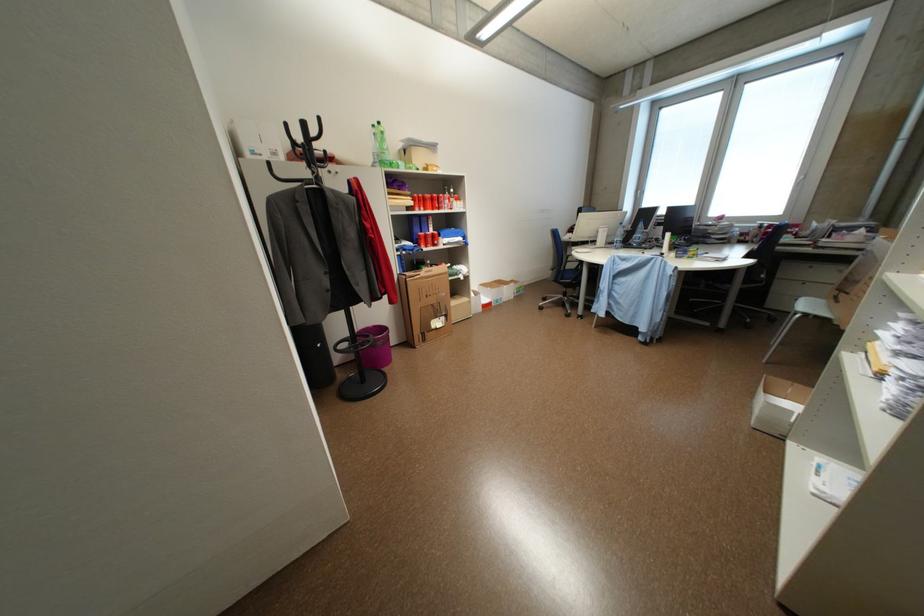
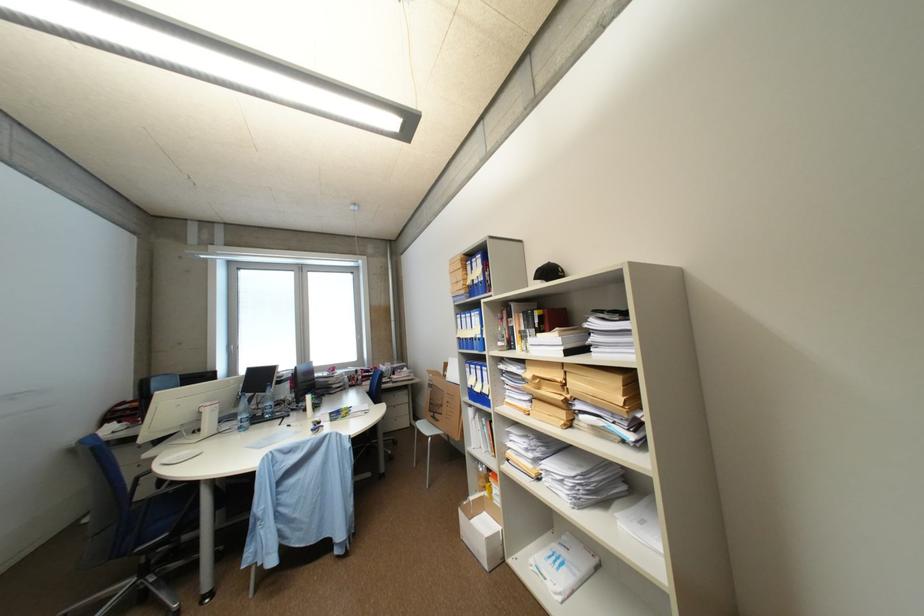
Question: The camera is either moving clockwise (left) or counter-clockwise (right) around the object. The first image is from the beginning of the video and the second image is from the end. Is the camera moving left or right when shooting the video?

Choices:
 (A) Left
 (B) Right

Answer: (A)